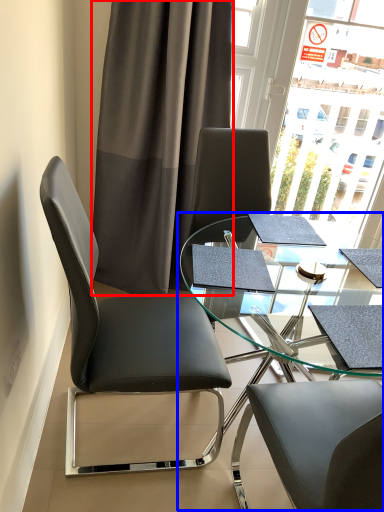
Question: Which point is further to the camera, curtain (highlighted by a red box) or table (highlighted by a blue box)?

Choices:
 (A) curtain
 (B) table

Answer: (A)